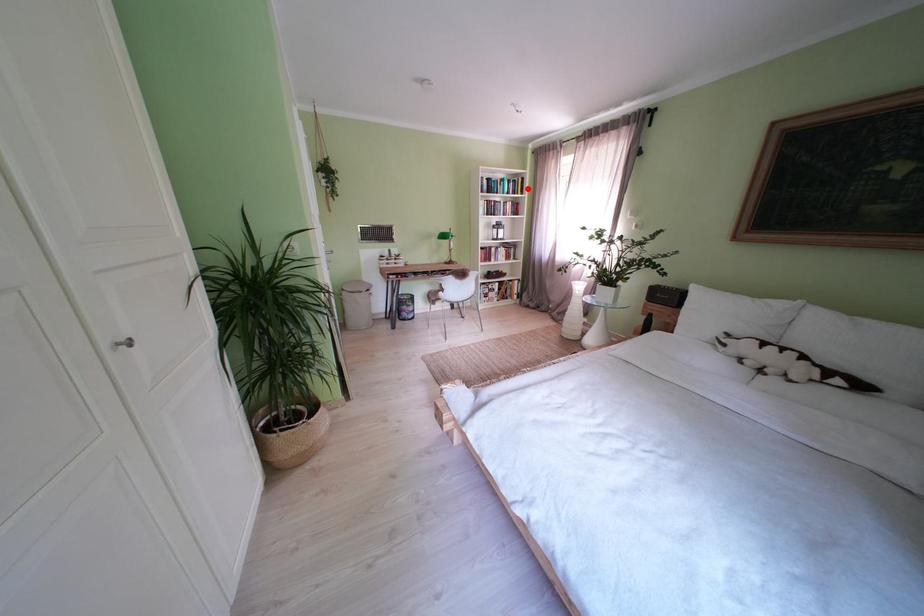
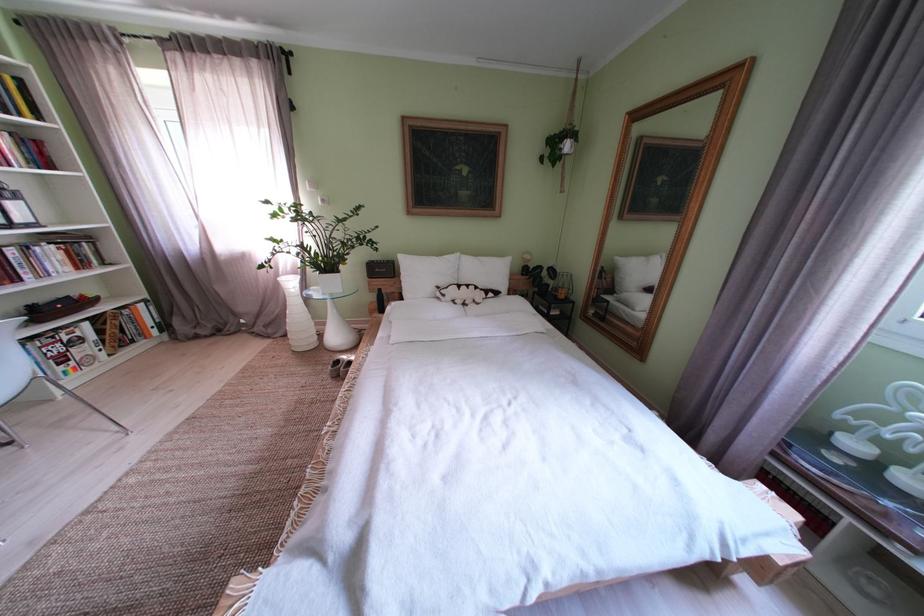
Question: A red point is marked in image1. In image2, is the corresponding 3D point closer to the camera or farther? Reply with the corresponding letter.

Choices:
 (A) The corresponding 3D point is closer.
 (B) The corresponding 3D point is farther.

Answer: (B)